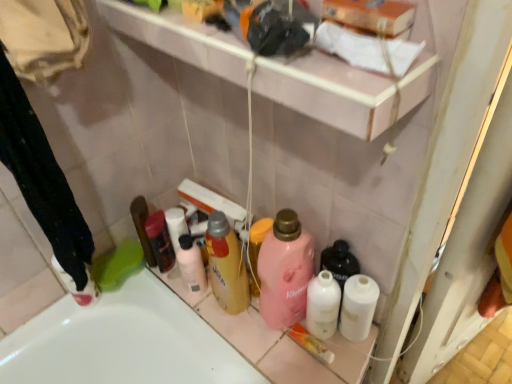
Question: From a real-world perspective, is white paper towel at upper center on pink matte bottle at center, the second cleaning product when ordered from left to right?

Choices:
 (A) no
 (B) yes

Answer: (B)

Question: Is white paper towel at upper center wider than pink matte bottle at center, the first cleaning product positioned from the right?

Choices:
 (A) no
 (B) yes

Answer: (A)

Question: Is white paper towel at upper center to the left of pink matte bottle at center, the second cleaning product when ordered from left to right, from the viewer's perspective?

Choices:
 (A) no
 (B) yes

Answer: (A)

Question: Does white paper towel at upper center touch pink matte bottle at center, the first cleaning product positioned from the right?

Choices:
 (A) no
 (B) yes

Answer: (A)

Question: Is white paper towel at upper center looking in the opposite direction of pink matte bottle at center, the second cleaning product when ordered from left to right?

Choices:
 (A) no
 (B) yes

Answer: (A)

Question: From the image's perspective, is matte black hair spray at left, placed as the 1th toiletry when sorted from left to right, positioned above or below translucent yellow bottle at center, the 2th cleaning product positioned from the right?

Choices:
 (A) above
 (B) below

Answer: (A)

Question: From a real-world perspective, is matte black hair spray at left, placed as the 1th toiletry when sorted from left to right, positioned above or below translucent yellow bottle at center, which appears as the 1th cleaning product when viewed from the left?

Choices:
 (A) below
 (B) above

Answer: (A)

Question: Based on their sizes in the image, would you say matte black hair spray at left, the fifth toiletry positioned from the right, is bigger or smaller than translucent yellow bottle at center, the 2th cleaning product positioned from the right?

Choices:
 (A) big
 (B) small

Answer: (B)

Question: Does point (159, 261) appear closer or farther from the camera than point (232, 301)?

Choices:
 (A) closer
 (B) farther

Answer: (B)

Question: Is white plastic bottle at center, the third toiletry from the right, situated inside black fabric laundry at lower left or outside?

Choices:
 (A) outside
 (B) inside

Answer: (A)

Question: Is white plastic bottle at center, acting as the third toiletry starting from the left, taller or shorter than black fabric laundry at lower left?

Choices:
 (A) short
 (B) tall

Answer: (A)

Question: From the image's perspective, is white plastic bottle at center, the third toiletry from the right, located above or below black fabric laundry at lower left?

Choices:
 (A) above
 (B) below

Answer: (B)

Question: Considering the positions of white plastic bottle at center, acting as the third toiletry starting from the left, and black fabric laundry at lower left in the image, is white plastic bottle at center, acting as the third toiletry starting from the left, wider or thinner than black fabric laundry at lower left?

Choices:
 (A) thin
 (B) wide

Answer: (A)

Question: Is white paper towel at upper center inside the boundaries of pink matte bottle at center, the second cleaning product when ordered from left to right, or outside?

Choices:
 (A) outside
 (B) inside

Answer: (A)

Question: From the image's perspective, relative to pink matte bottle at center, the second cleaning product when ordered from left to right, is white paper towel at upper center above or below?

Choices:
 (A) above
 (B) below

Answer: (A)